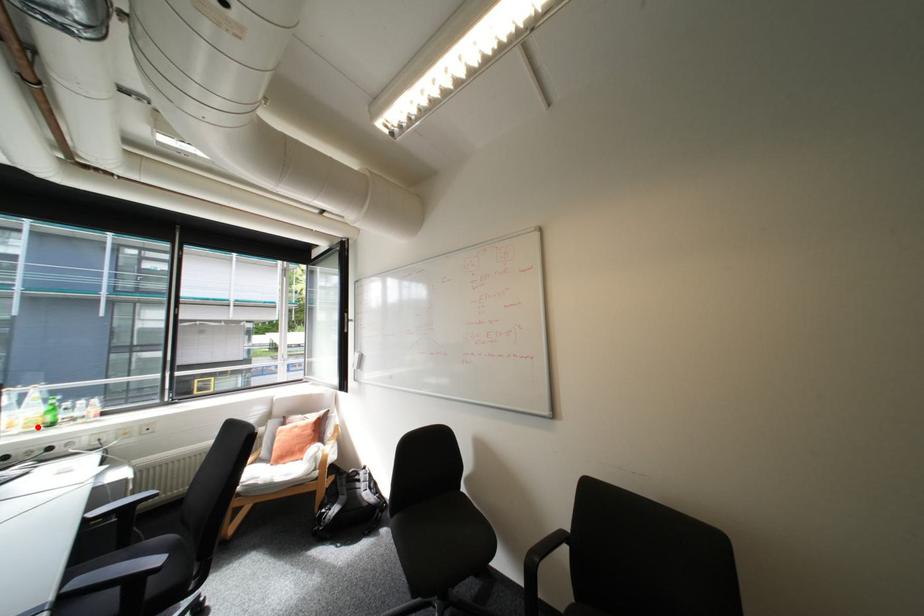
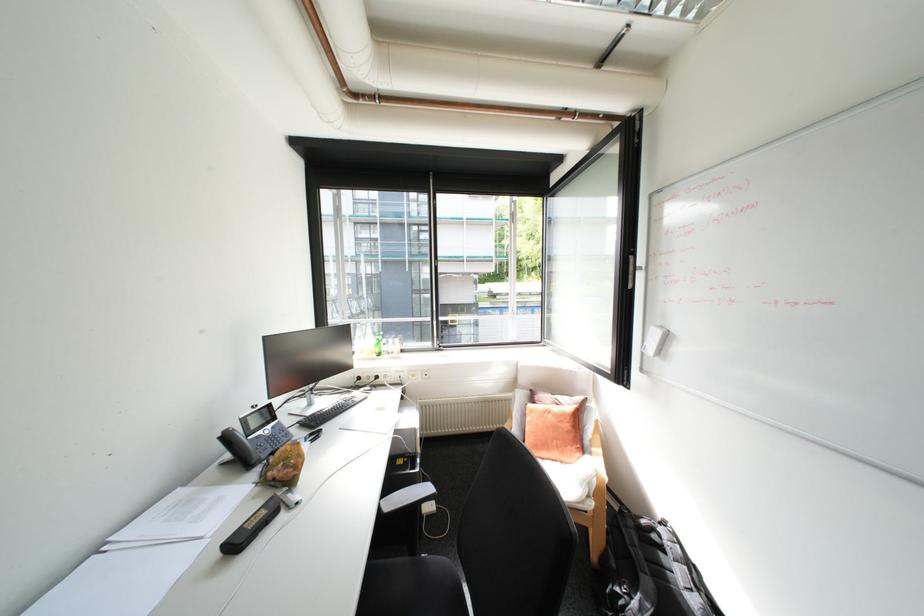
In the second image, find the point that corresponds to the highlighted location in the first image.

(379, 354)